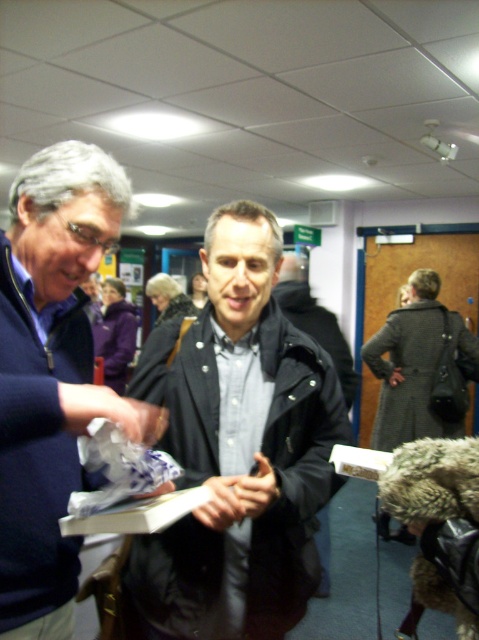
You are organizing a small event and need to place a 10 inch wide decorative item between the matte black jacket at center and the blue sweater at left. Can the item fit in the space between them?

The distance between the matte black jacket at center and the blue sweater at left is 9.32 inches. Since the decorative item is 10 inches wide, it cannot fit in the space between them.

You are standing in the middle of the room and see two points in the scene. Which point, point (161, 410) or point (307, 323), is closer to you?

Point (161, 410) is closer to the viewer than point (307, 323).

You are organizing a coat check at the event and need to determine if both the matte black jacket at center and the dark gray fabric coat at center can fit side by side on a single hanger. The hanger has a maximum width capacity of 1.2 meters. Can both items be placed together on the hanger without exceeding its width limit?

The matte black jacket at center might be wider than dark gray fabric coat at center, but since the combined width of both items could potentially exceed the hanger limit, it is uncertain without exact measurements. However, if the matte black jacket at center is wider but still within the 1.2 meters when combined with the dark gray fabric coat at center, then they could fit. Otherwise, they might need separate hangers.